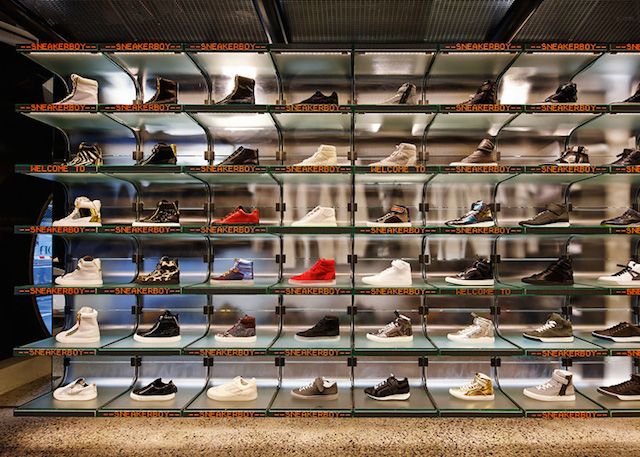
You are a GUI agent. You are given a task and a screenshot of the screen. Output one action in this format:
    pyautogui.click(x=<x>, y=<y>)
    Task: Click on the sneakers on 7th shelve
    Image resolution: width=640 pixels, height=457 pixels.
    Given the screenshot: What is the action you would take?
    pyautogui.click(x=76, y=91), pyautogui.click(x=166, y=97), pyautogui.click(x=237, y=97), pyautogui.click(x=315, y=98), pyautogui.click(x=406, y=97), pyautogui.click(x=490, y=95), pyautogui.click(x=633, y=99)